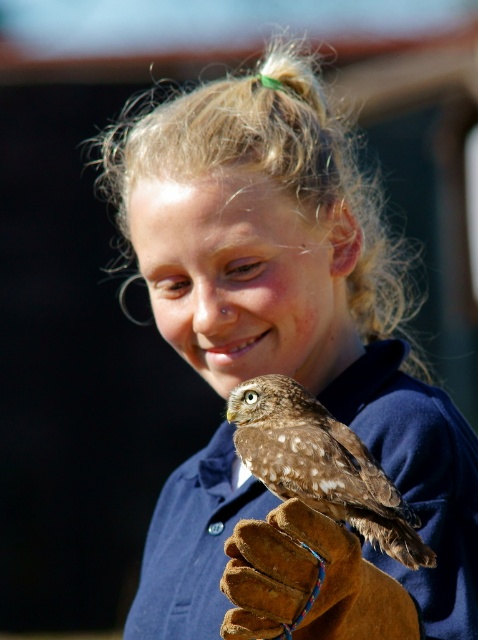
Question: Among these objects, which one is farthest from the camera?

Choices:
 (A) brown leather glove at lower center
 (B) brown speckled owl at lower center

Answer: (B)

Question: Is brown leather glove at lower center smaller than brown speckled owl at lower center?

Choices:
 (A) yes
 (B) no

Answer: (A)

Question: Can you confirm if brown leather glove at lower center is smaller than brown speckled owl at lower center?

Choices:
 (A) no
 (B) yes

Answer: (B)

Question: Can you confirm if brown leather glove at lower center is wider than brown speckled owl at lower center?

Choices:
 (A) no
 (B) yes

Answer: (A)